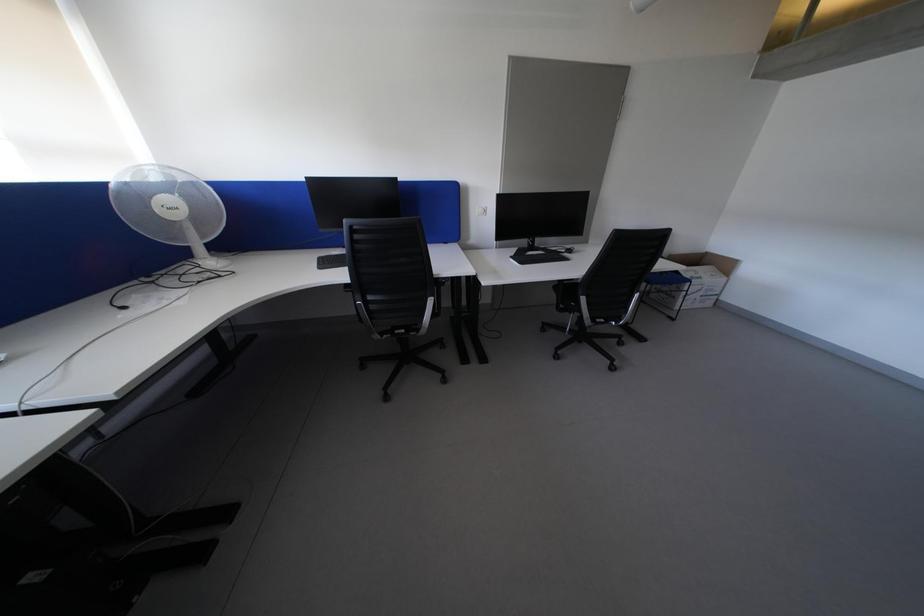
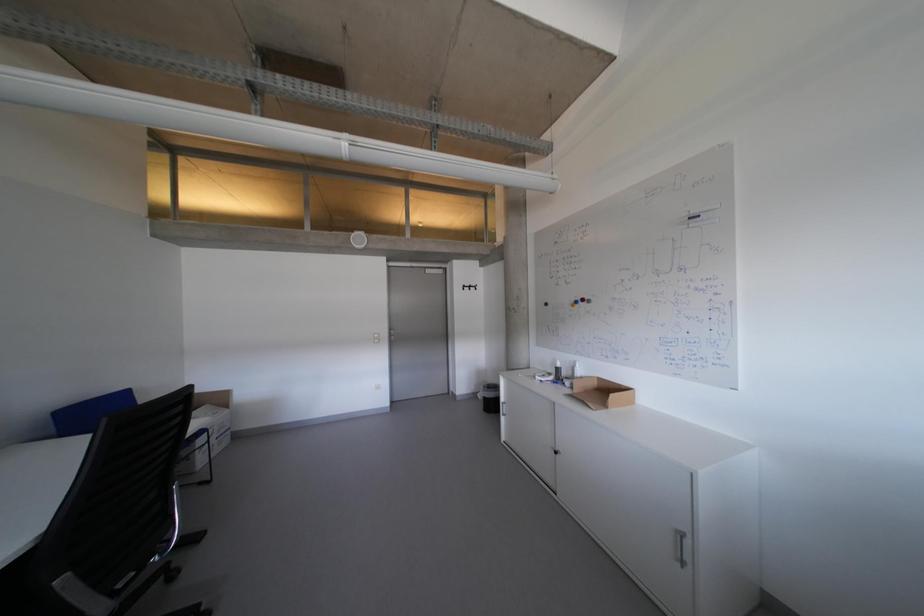
Question: The camera is either moving clockwise (left) or counter-clockwise (right) around the object. The first image is from the beginning of the video and the second image is from the end. Is the camera moving left or right when shooting the video?

Choices:
 (A) Left
 (B) Right

Answer: (A)